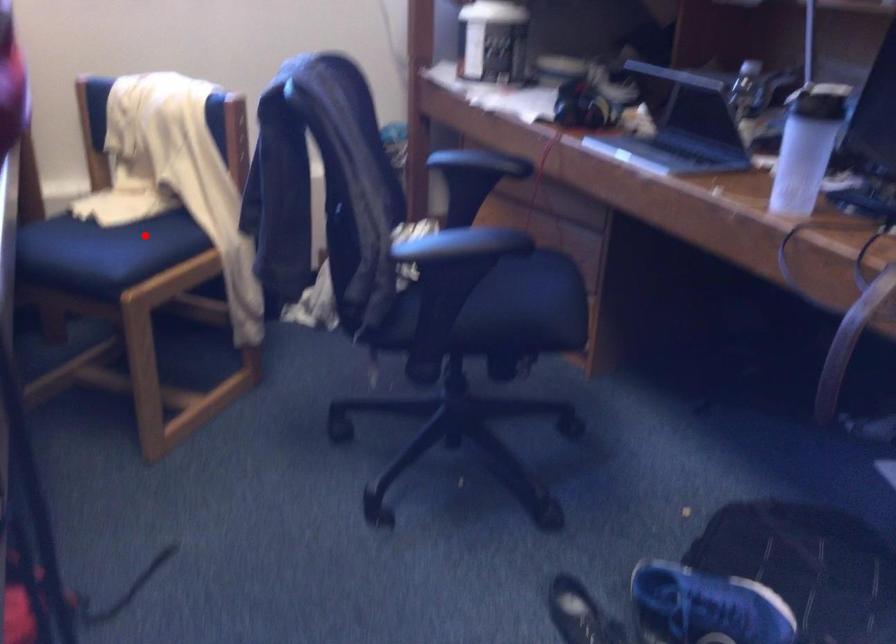
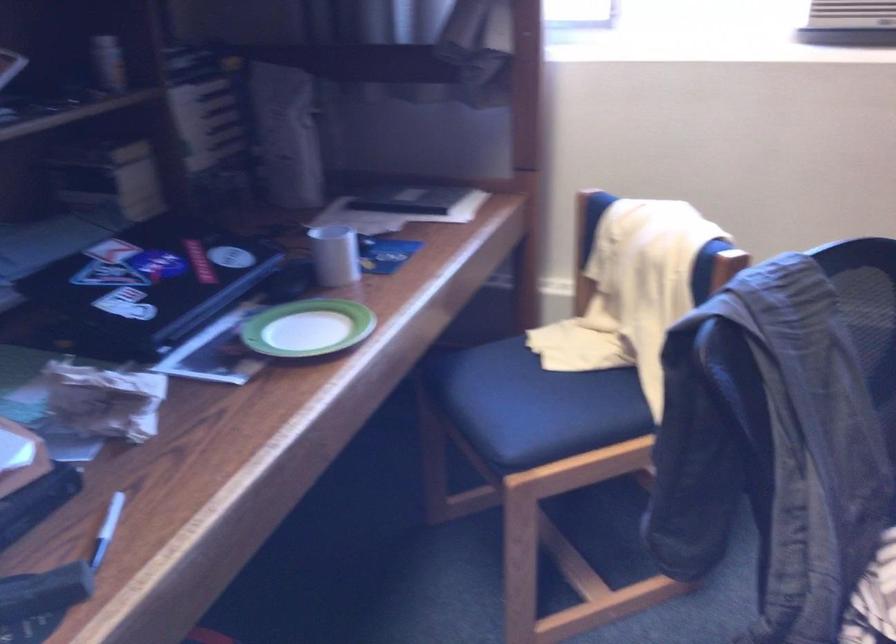
In the second image, find the point that corresponds to the highlighted location in the first image.

(576, 393)